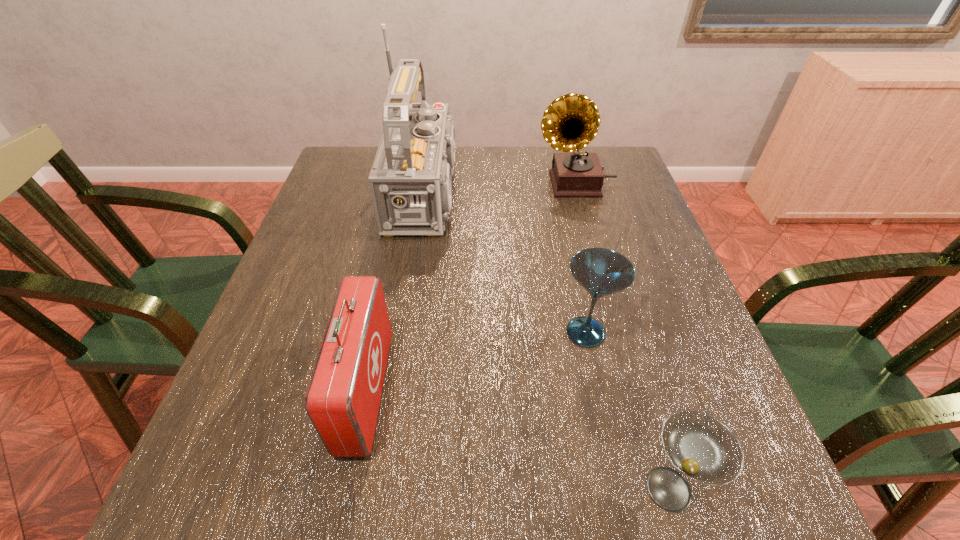
Identify the location of vacant space that is in between the radio receiver and the nearer martini. The height and width of the screenshot is (540, 960). (551, 341).

Where is `vacant area between the third tallest object and the farther martini`? This screenshot has height=540, width=960. vacant area between the third tallest object and the farther martini is located at coordinates (476, 362).

Identify the location of vacant region between the tallest object and the fourth shortest object. The width and height of the screenshot is (960, 540). (504, 188).

Find the location of a particular element. unoccupied position between the nearer martini and the phonograph record is located at coordinates (622, 336).

Identify the location of object that can be found as the fourth closest to the nearer martini. (570, 122).

Image resolution: width=960 pixels, height=540 pixels. I want to click on object that is the third closest to the radio receiver, so click(x=342, y=401).

Where is `free region that satisfies the following two spatial constraints: 1. on the front-facing side of the nearer martini; 2. on the left side of the tallest object`? free region that satisfies the following two spatial constraints: 1. on the front-facing side of the nearer martini; 2. on the left side of the tallest object is located at coordinates (396, 489).

Where is `vacant point that satisfies the following two spatial constraints: 1. from the horn of the phonograph record; 2. on the back side of the nearer martini`? The height and width of the screenshot is (540, 960). vacant point that satisfies the following two spatial constraints: 1. from the horn of the phonograph record; 2. on the back side of the nearer martini is located at coordinates (659, 489).

The height and width of the screenshot is (540, 960). Find the location of `free region that satisfies the following two spatial constraints: 1. on the side of the first-aid kit with the first aid cross symbol; 2. on the back side of the nearer martini`. free region that satisfies the following two spatial constraints: 1. on the side of the first-aid kit with the first aid cross symbol; 2. on the back side of the nearer martini is located at coordinates (346, 489).

Image resolution: width=960 pixels, height=540 pixels. I want to click on blank area in the image that satisfies the following two spatial constraints: 1. on the side of the first-aid kit with the first aid cross symbol; 2. on the left side of the nearer martini, so click(x=346, y=489).